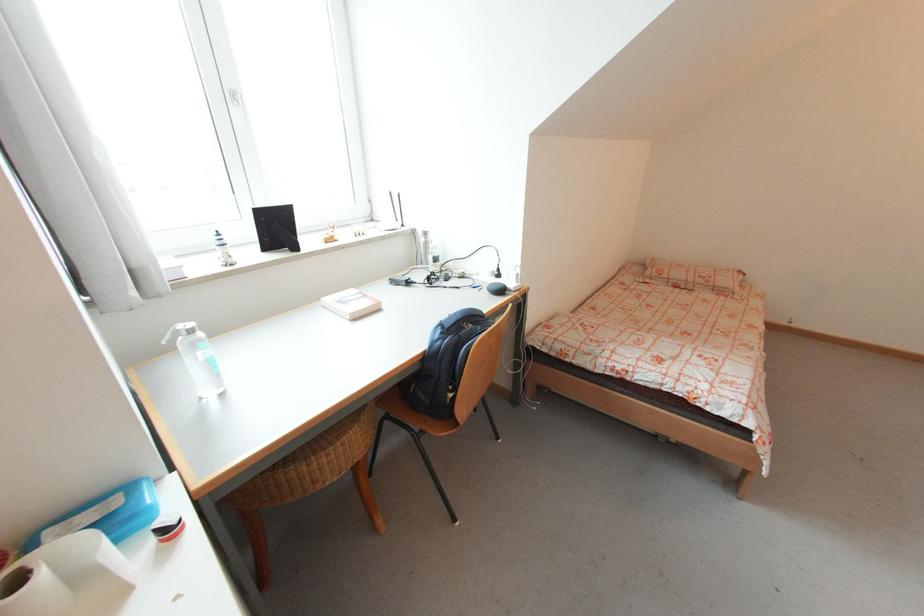
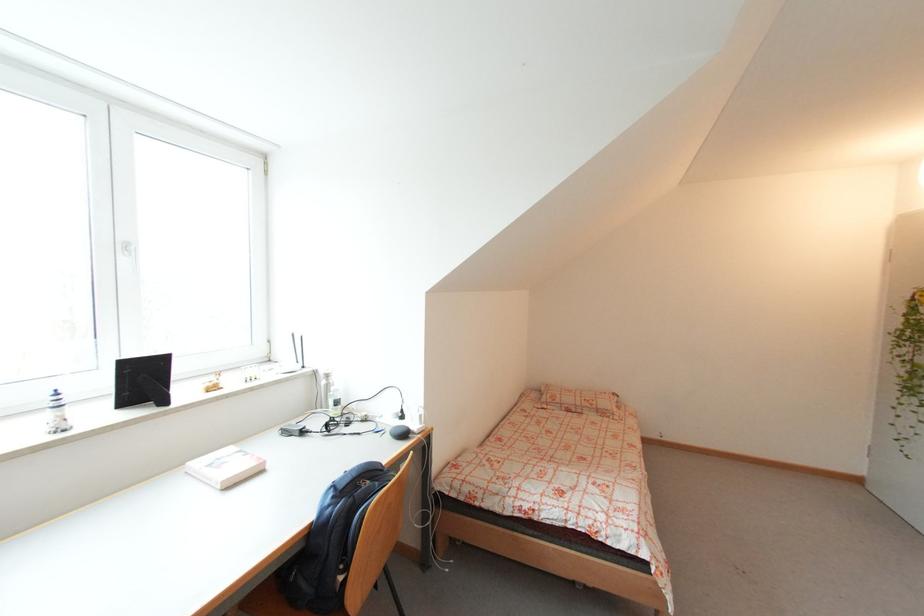
Where in the second image is the point corresponding to (221,233) from the first image?

(58, 392)